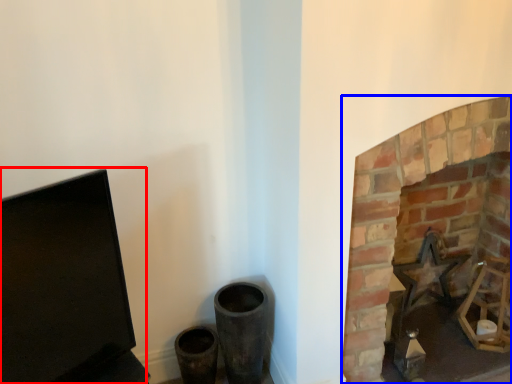
Question: Which point is further to the camera, computer monitor (highlighted by a red box) or fireplace (highlighted by a blue box)?

Choices:
 (A) computer monitor
 (B) fireplace

Answer: (B)